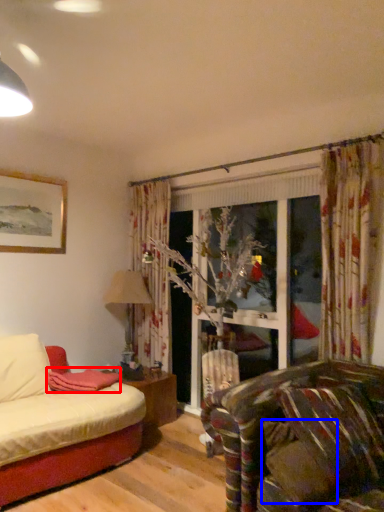
Question: Which object appears farthest to the camera in this image, blanket (highlighted by a red box) or pillow (highlighted by a blue box)?

Choices:
 (A) blanket
 (B) pillow

Answer: (A)